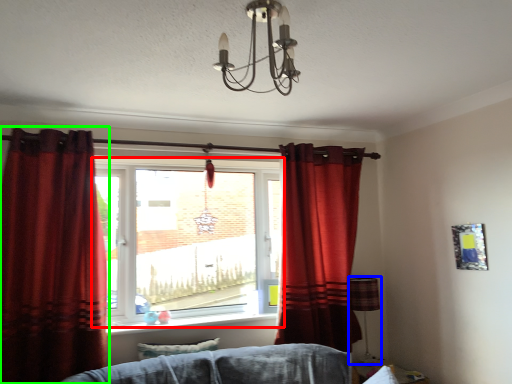
Question: Based on their relative distances, which object is nearer to window (highlighted by a red box)? Choose from lamp (highlighted by a blue box) and curtain (highlighted by a green box).

Choices:
 (A) lamp
 (B) curtain

Answer: (B)